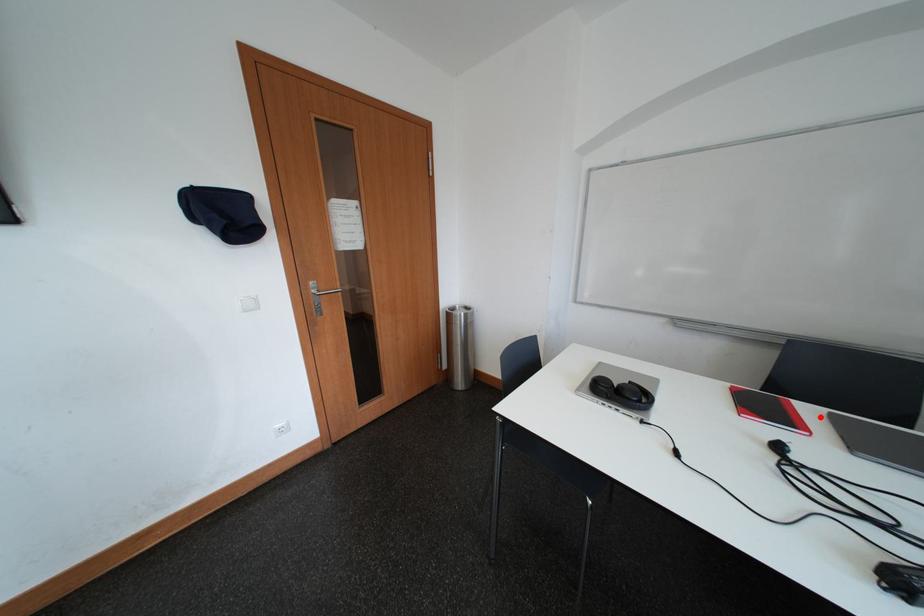
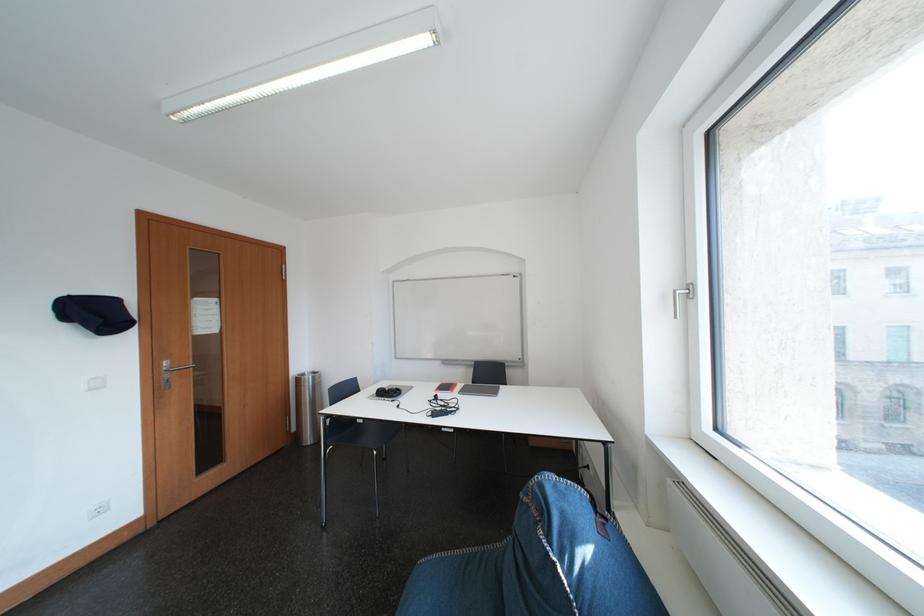
Find the pixel in the second image that matches the highlighted location in the first image.

(470, 390)